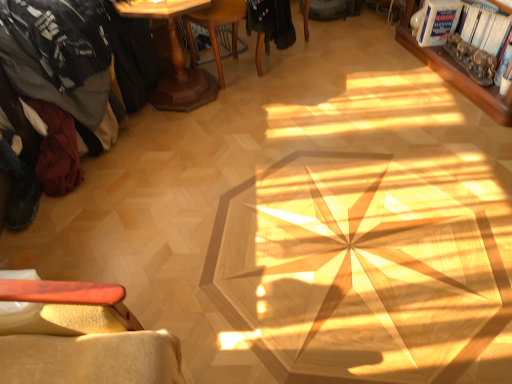
The width and height of the screenshot is (512, 384). What do you see at coordinates (215, 28) in the screenshot? I see `wooden at center, the 1th chair in the left-to-right sequence` at bounding box center [215, 28].

Locate an element on the screen. The width and height of the screenshot is (512, 384). wooden bookshelf at upper right is located at coordinates (455, 73).

The image size is (512, 384). In order to click on wooden pedestal table at upper left in this screenshot , I will do `click(174, 57)`.

What do you see at coordinates (438, 22) in the screenshot? I see `white glossy magazine at upper right, positioned as the 1th magazine in top-to-bottom order` at bounding box center [438, 22].

What do you see at coordinates (479, 42) in the screenshot?
I see `metallic silver magazine at upper right, which appears as the first magazine when ordered from the bottom` at bounding box center [479, 42].

At what (x,y) coordinates should I click in order to perform the action: click on wooden at center, the 1th chair in the left-to-right sequence. Please return your answer as a coordinate pair (x, y). Image resolution: width=512 pixels, height=384 pixels. Looking at the image, I should click on pos(215,28).

Is wooden bookshelf at upper right taller than metallic silver magazine at upper right, which appears as the first magazine when ordered from the bottom?

Correct, wooden bookshelf at upper right is much taller as metallic silver magazine at upper right, which appears as the first magazine when ordered from the bottom.

Does wooden bookshelf at upper right turn towards metallic silver magazine at upper right, which appears as the first magazine when ordered from the bottom?

Yes.

From a real-world perspective, is wooden bookshelf at upper right positioned above or below metallic silver magazine at upper right, the second magazine viewed from the top?

wooden bookshelf at upper right is situated higher than metallic silver magazine at upper right, the second magazine viewed from the top, in the real world.

Who is more distant, wooden bookshelf at upper right or metallic silver magazine at upper right, the second magazine viewed from the top?

metallic silver magazine at upper right, the second magazine viewed from the top, is more distant.

Is black fabric chair at center, arranged as the first chair when viewed from the right, oriented away from metallic silver magazine at upper right, which appears as the first magazine when ordered from the bottom?

black fabric chair at center, arranged as the first chair when viewed from the right, is not turned away from metallic silver magazine at upper right, which appears as the first magazine when ordered from the bottom.

In the scene shown: Is black fabric chair at center, positioned as the 2th chair in left-to-right order, wider than metallic silver magazine at upper right, the second magazine viewed from the top?

Yes, black fabric chair at center, positioned as the 2th chair in left-to-right order, is wider than metallic silver magazine at upper right, the second magazine viewed from the top.

Choose the correct answer: Is black fabric chair at center, arranged as the first chair when viewed from the right, inside metallic silver magazine at upper right, the second magazine viewed from the top, or outside it?

black fabric chair at center, arranged as the first chair when viewed from the right, is located beyond the bounds of metallic silver magazine at upper right, the second magazine viewed from the top.

Considering the relative positions of dark gray fabric at left and wooden at center, the 1th chair in the left-to-right sequence, in the image provided, is dark gray fabric at left to the right of wooden at center, the 1th chair in the left-to-right sequence, from the viewer's perspective?

No, dark gray fabric at left is not to the right of wooden at center, the 1th chair in the left-to-right sequence.

How many degrees apart are the facing directions of dark gray fabric at left and wooden at center, the 1th chair in the left-to-right sequence?

There is a 142-degree angle between the facing directions of dark gray fabric at left and wooden at center, the 1th chair in the left-to-right sequence.

Are dark gray fabric at left and wooden at center, the second chair when ordered from right to left, located far from each other?

No, dark gray fabric at left is in close proximity to wooden at center, the second chair when ordered from right to left.

From the image's perspective, is wooden bookshelf at upper right beneath dark gray fabric at left?

Incorrect, from the image's perspective, wooden bookshelf at upper right is higher than dark gray fabric at left.

Would you consider wooden bookshelf at upper right to be distant from dark gray fabric at left?

That's right, there is a large distance between wooden bookshelf at upper right and dark gray fabric at left.

Is wooden bookshelf at upper right outside of dark gray fabric at left?

Yes, wooden bookshelf at upper right is outside of dark gray fabric at left.

In the scene shown: Which is behind, wooden bookshelf at upper right or dark gray fabric at left?

A: Positioned behind is wooden bookshelf at upper right.

From the image's perspective, which is below, dark gray fabric at left or metallic silver magazine at upper right, which appears as the first magazine when ordered from the bottom?

dark gray fabric at left is shown below in the image.

Which of these two, dark gray fabric at left or metallic silver magazine at upper right, the second magazine viewed from the top, is wider?

dark gray fabric at left is wider.

Which magazine is the 1st one when counting from the back of the dark gray fabric at left? Please provide its 2D coordinates.

[(479, 42)]

Considering their positions, is dark gray fabric at left located in front of or behind metallic silver magazine at upper right, which appears as the first magazine when ordered from the bottom?

Clearly, dark gray fabric at left is in front of metallic silver magazine at upper right, which appears as the first magazine when ordered from the bottom.

Can you confirm if wooden bookshelf at upper right is thinner than black fabric chair at center, positioned as the 2th chair in left-to-right order?

No.

Is wooden bookshelf at upper right far away from black fabric chair at center, positioned as the 2th chair in left-to-right order?

That's not correct — wooden bookshelf at upper right is a little close to black fabric chair at center, positioned as the 2th chair in left-to-right order.

Can we say wooden bookshelf at upper right lies outside black fabric chair at center, positioned as the 2th chair in left-to-right order?

wooden bookshelf at upper right is positioned outside black fabric chair at center, positioned as the 2th chair in left-to-right order.

From the image's perspective, which one is positioned lower, metallic silver magazine at upper right, the second magazine viewed from the top, or wooden at center, the 1th chair in the left-to-right sequence?

metallic silver magazine at upper right, the second magazine viewed from the top.

Which of these two, metallic silver magazine at upper right, which appears as the first magazine when ordered from the bottom, or wooden at center, the second chair when ordered from right to left, is smaller?

Smaller between the two is metallic silver magazine at upper right, which appears as the first magazine when ordered from the bottom.

Based on the photo, considering their positions, is metallic silver magazine at upper right, which appears as the first magazine when ordered from the bottom, located in front of or behind wooden at center, the 1th chair in the left-to-right sequence?

Visually, metallic silver magazine at upper right, which appears as the first magazine when ordered from the bottom, is located behind wooden at center, the 1th chair in the left-to-right sequence.

From a real-world perspective, is metallic silver magazine at upper right, which appears as the first magazine when ordered from the bottom, physically located above or below wooden at center, the second chair when ordered from right to left?

metallic silver magazine at upper right, which appears as the first magazine when ordered from the bottom, is below wooden at center, the second chair when ordered from right to left.

You are a GUI agent. You are given a task and a screenshot of the screen. Output one action in this format:
    pyautogui.click(x=<x>, y=<y>)
    Task: Click on the bookcase above the metallic silver magazine at upper right, which appears as the first magazine when ordered from the bottom (from the image's perspective)
    
    Given the screenshot: What is the action you would take?
    coord(455,73)

Locate an element on the screen. Image resolution: width=512 pixels, height=384 pixels. chair that is the 1st object to the left of the metallic silver magazine at upper right, the second magazine viewed from the top, starting at the anchor is located at coordinates (269, 25).

Which object lies further to the anchor point wooden at center, the second chair when ordered from right to left, black fabric chair at center, arranged as the first chair when viewed from the right, or wooden pedestal table at upper left?

Based on the image, black fabric chair at center, arranged as the first chair when viewed from the right, appears to be further to wooden at center, the second chair when ordered from right to left.

From the image, which object appears to be farther from wooden bookshelf at upper right, dark gray fabric at left or wooden pedestal table at upper left?

dark gray fabric at left.

Estimate the real-world distances between objects in this image. Which object is further from metallic silver magazine at upper right, the second magazine viewed from the top, white glossy magazine at upper right, which is the 2th magazine from bottom to top, or wooden at center, the 1th chair in the left-to-right sequence?

Based on the image, wooden at center, the 1th chair in the left-to-right sequence, appears to be further to metallic silver magazine at upper right, the second magazine viewed from the top.

Considering their positions, is wooden pedestal table at upper left positioned closer to metallic silver magazine at upper right, which appears as the first magazine when ordered from the bottom, than black fabric chair at center, positioned as the 2th chair in left-to-right order?

Answer: Among the two, black fabric chair at center, positioned as the 2th chair in left-to-right order, is located nearer to metallic silver magazine at upper right, which appears as the first magazine when ordered from the bottom.

Considering their positions, is wooden bookshelf at upper right positioned further to wooden pedestal table at upper left than black fabric chair at center, positioned as the 2th chair in left-to-right order?

The object further to wooden pedestal table at upper left is wooden bookshelf at upper right.

Looking at the image, which one is located further to white glossy magazine at upper right, positioned as the 1th magazine in top-to-bottom order, black fabric chair at center, positioned as the 2th chair in left-to-right order, or dark gray fabric at left?

The object further to white glossy magazine at upper right, positioned as the 1th magazine in top-to-bottom order, is dark gray fabric at left.

Considering their positions, is dark gray fabric at left positioned further to black fabric chair at center, positioned as the 2th chair in left-to-right order, than metallic silver magazine at upper right, the second magazine viewed from the top?

Among the two, metallic silver magazine at upper right, the second magazine viewed from the top, is located further to black fabric chair at center, positioned as the 2th chair in left-to-right order.

Based on their spatial positions, is black fabric chair at center, positioned as the 2th chair in left-to-right order, or wooden at center, the 1th chair in the left-to-right sequence, closer to wooden bookshelf at upper right?

black fabric chair at center, positioned as the 2th chair in left-to-right order.

Where is `magazine positioned between wooden bookshelf at upper right and white glossy magazine at upper right, positioned as the 1th magazine in top-to-bottom order, from near to far`? Image resolution: width=512 pixels, height=384 pixels. magazine positioned between wooden bookshelf at upper right and white glossy magazine at upper right, positioned as the 1th magazine in top-to-bottom order, from near to far is located at coordinates (479, 42).

The height and width of the screenshot is (384, 512). Find the location of `table between dark gray fabric at left and metallic silver magazine at upper right, which appears as the first magazine when ordered from the bottom`. table between dark gray fabric at left and metallic silver magazine at upper right, which appears as the first magazine when ordered from the bottom is located at coordinates (174, 57).

Find the location of a particular element. magazine between wooden at center, the second chair when ordered from right to left, and metallic silver magazine at upper right, which appears as the first magazine when ordered from the bottom, from left to right is located at coordinates (438, 22).

In order to click on chair between dark gray fabric at left and black fabric chair at center, positioned as the 2th chair in left-to-right order, in the horizontal direction in this screenshot , I will do click(x=215, y=28).